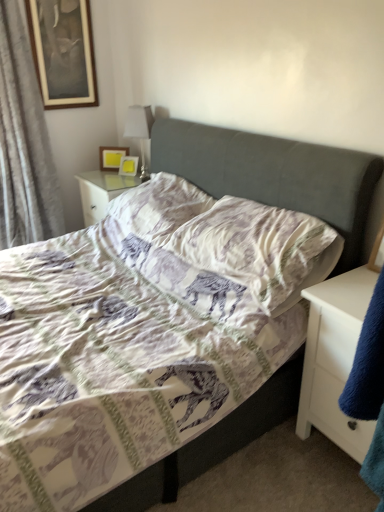
Question: From a real-world perspective, is gray fabric curtain at left beneath white glossy table lamp at upper center?

Choices:
 (A) yes
 (B) no

Answer: (B)

Question: Does gray fabric curtain at left have a lesser width compared to white glossy table lamp at upper center?

Choices:
 (A) yes
 (B) no

Answer: (B)

Question: Does gray fabric curtain at left turn towards white glossy table lamp at upper center?

Choices:
 (A) yes
 (B) no

Answer: (B)

Question: Considering the relative sizes of gray fabric curtain at left and white glossy table lamp at upper center in the image provided, is gray fabric curtain at left bigger than white glossy table lamp at upper center?

Choices:
 (A) yes
 (B) no

Answer: (A)

Question: Is gray fabric curtain at left further to the viewer compared to white glossy table lamp at upper center?

Choices:
 (A) no
 (B) yes

Answer: (A)

Question: Is gray fabric curtain at left not inside white glossy table lamp at upper center?

Choices:
 (A) no
 (B) yes

Answer: (B)

Question: Considering the relative positions of white glossy table lamp at upper center and gray fabric curtain at left in the image provided, is white glossy table lamp at upper center to the right of gray fabric curtain at left from the viewer's perspective?

Choices:
 (A) yes
 (B) no

Answer: (A)

Question: From a real-world perspective, is white glossy table lamp at upper center under gray fabric curtain at left?

Choices:
 (A) no
 (B) yes

Answer: (B)

Question: Considering the relative sizes of white glossy table lamp at upper center and gray fabric curtain at left in the image provided, is white glossy table lamp at upper center shorter than gray fabric curtain at left?

Choices:
 (A) no
 (B) yes

Answer: (B)

Question: Does white glossy table lamp at upper center appear on the left side of gray fabric curtain at left?

Choices:
 (A) yes
 (B) no

Answer: (B)

Question: From a real-world perspective, is white glossy table lamp at upper center positioned over gray fabric curtain at left based on gravity?

Choices:
 (A) yes
 (B) no

Answer: (B)

Question: Considering the relative positions of white glossy table lamp at upper center and gray fabric curtain at left in the image provided, is white glossy table lamp at upper center in front of gray fabric curtain at left?

Choices:
 (A) no
 (B) yes

Answer: (A)

Question: Is white fabric pillow at center, marked as the second pillow in a front-to-back arrangement, positioned beyond the bounds of white glossy table lamp at upper center?

Choices:
 (A) yes
 (B) no

Answer: (A)